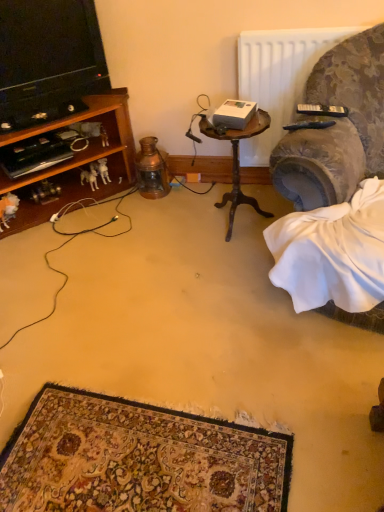
Find the location of a particular element. Image resolution: width=384 pixels, height=512 pixels. vacant area that lies between wooden table at center and black cable at left is located at coordinates (167, 249).